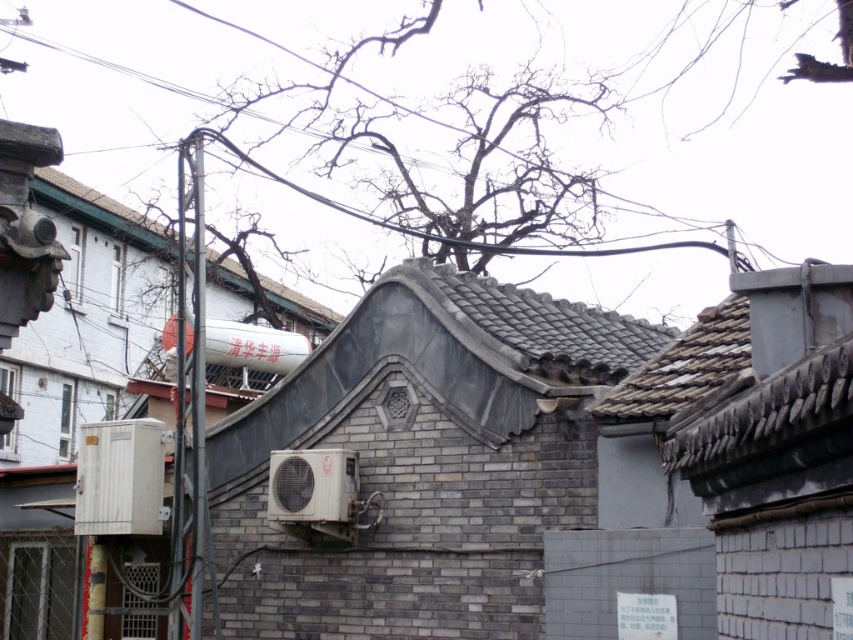
You are standing in front of the building with a curved, tiled roof and want to take a photo of the point at coordinates (387, 104). The camera you are using has a maximum focus range of 100 meters. Will the point be in focus?

The point at coordinates (387, 104) is 114.78 meters from the viewer, which exceeds the camera maximum focus range of 100 meters. Therefore, the point will not be in focus.

You are standing in front of the building with the curved roof and notice a black wire at upper center. Where exactly is the black wire located in relation to the building?

The black wire at upper center is located at point (473,241) relative to the building.

You are an electrician assessing the scene. You need to determine if the black wire at upper center can be safely moved without affecting the gray tile roof at upper center. Based on their widths, what is your assessment?

The black wire at upper center is wider than the gray tile roof at upper center. Moving the wire might require careful planning to ensure it doesn not interfere with the roof structure, especially given its greater width.